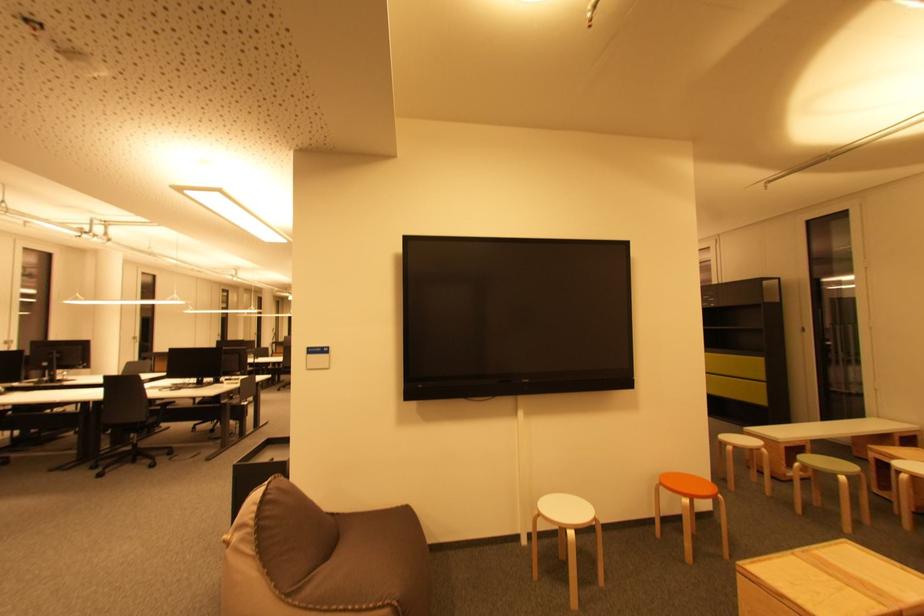
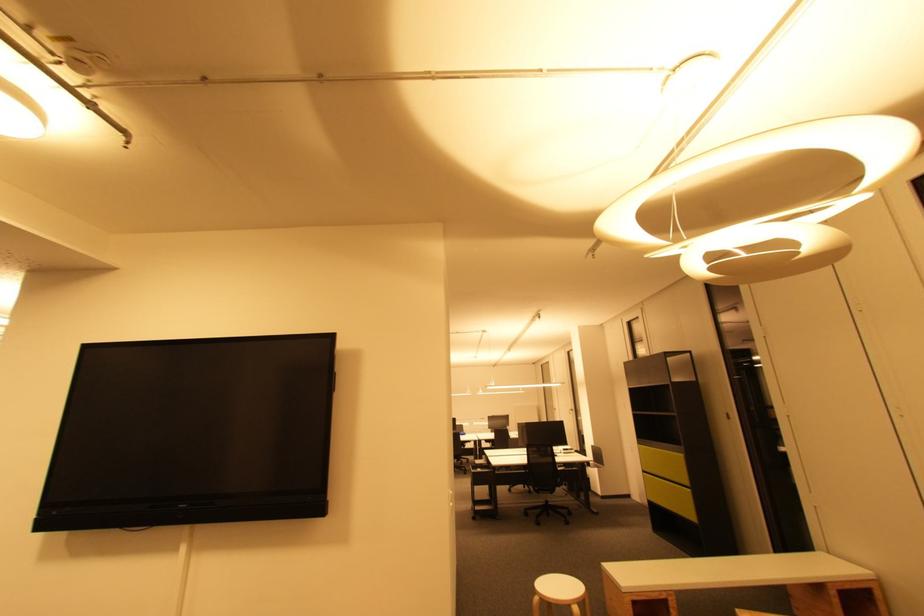
Question: Which direction would the cameraman need to move to produce the second image? Reply with the corresponding letter.

Choices:
 (A) Left
 (B) Right
 (C) Forward
 (D) Backward

Answer: (B)